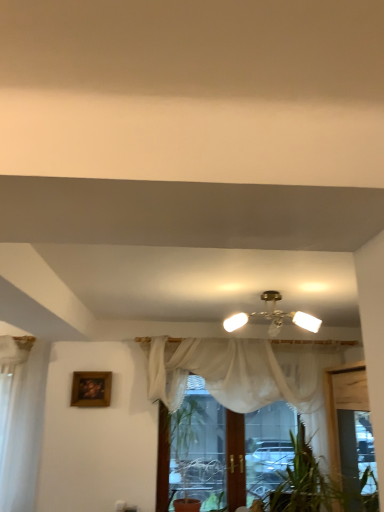
Question: From a real-world perspective, is wooden framed painting at upper left physically located above or below matte brass chandelier at center?

Choices:
 (A) above
 (B) below

Answer: (B)

Question: Is point (92, 391) positioned closer to the camera than point (279, 327)?

Choices:
 (A) farther
 (B) closer

Answer: (B)

Question: Estimate the real-world distances between objects in this image. Which object is farther from the white sheer curtain at center?

Choices:
 (A) matte brass chandelier at center
 (B) wooden framed painting at upper left

Answer: (B)

Question: Based on their relative distances, which object is farther from the white sheer curtain at center?

Choices:
 (A) wooden framed painting at upper left
 (B) matte brass chandelier at center

Answer: (A)